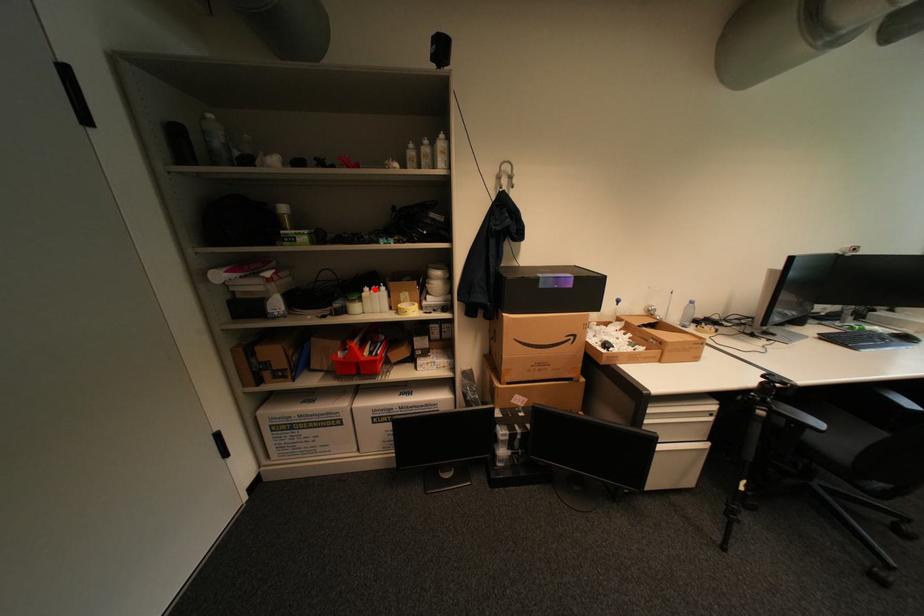
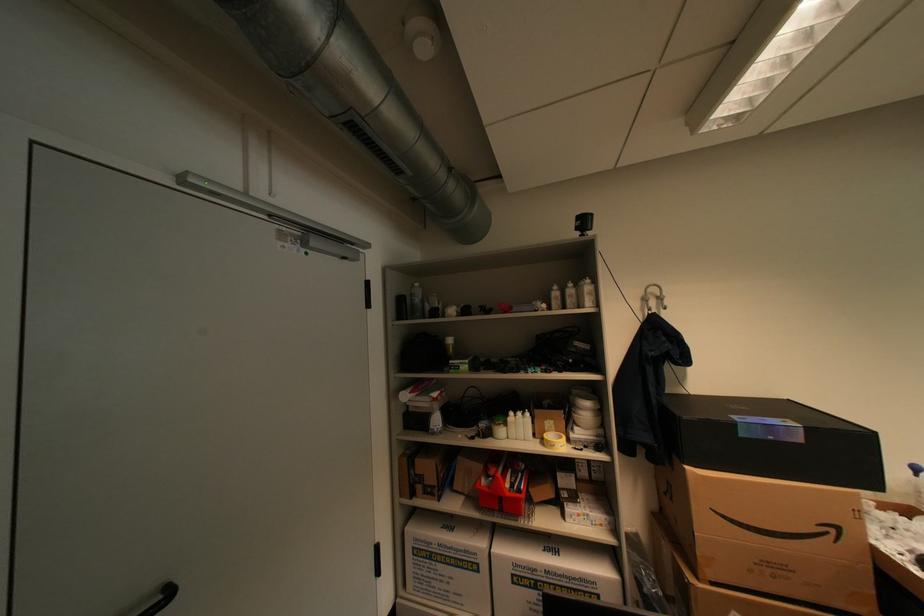
Question: A red point is marked in image1. In image2, is the corresponding 3D point closer to the camera or farther? Reply with the corresponding letter.

Choices:
 (A) The corresponding 3D point is closer.
 (B) The corresponding 3D point is farther.

Answer: (B)